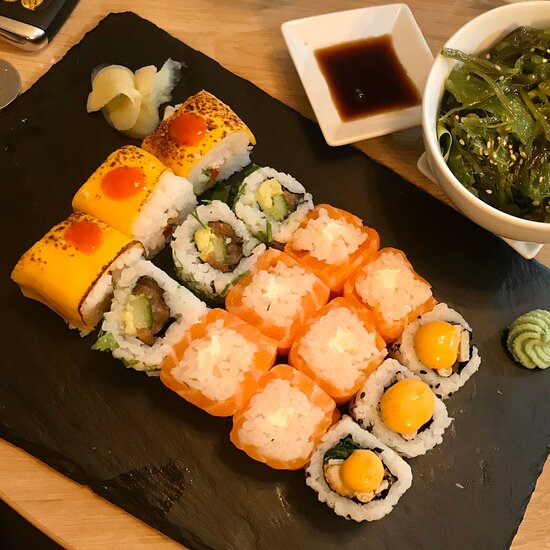
Where is `bowl of greens`? This screenshot has height=550, width=550. bowl of greens is located at coordinates (502, 163).